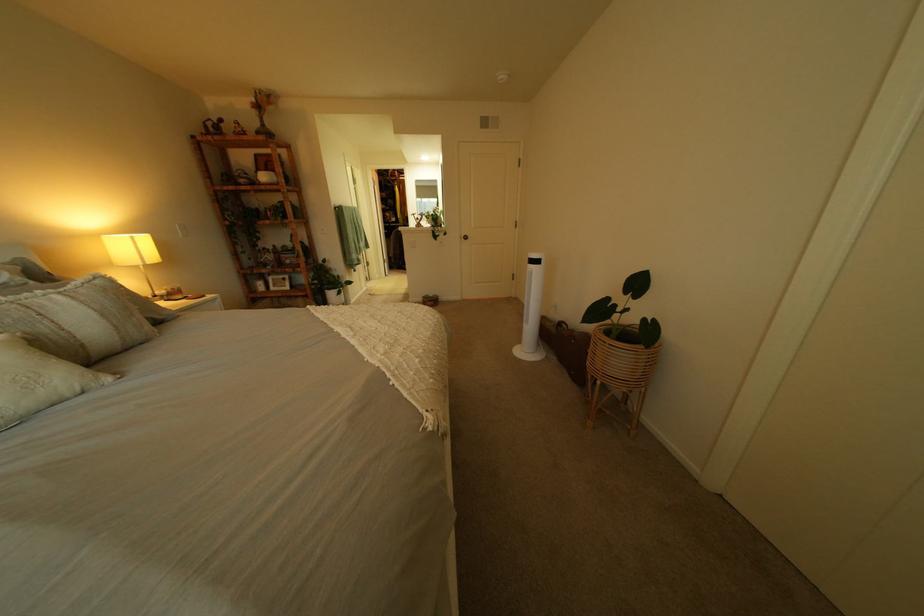
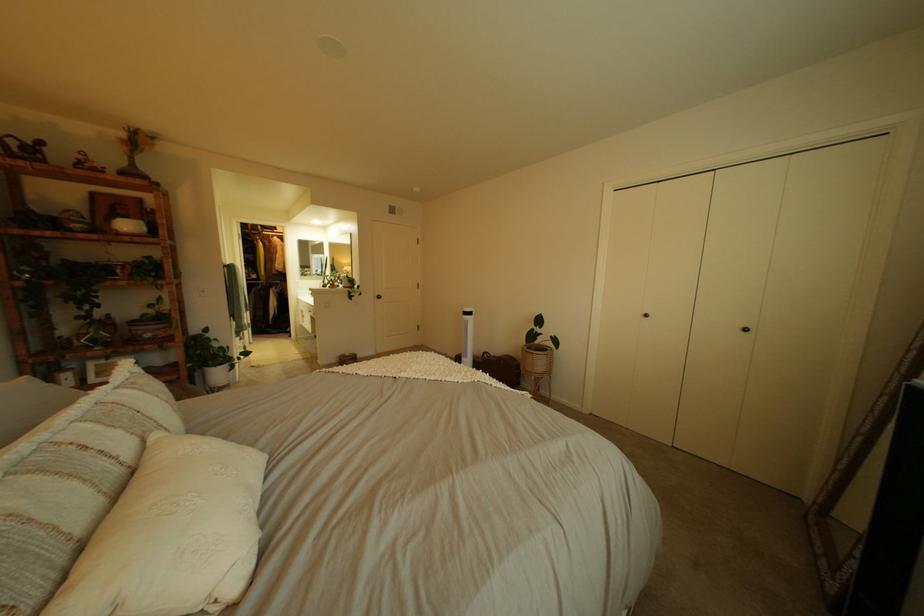
The point at [275,183] is marked in the first image. Where is the corresponding point in the second image?

(132, 232)